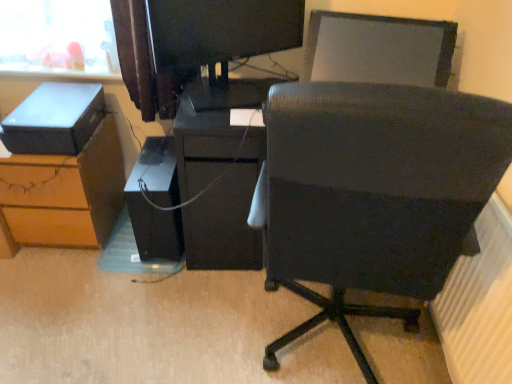
This screenshot has width=512, height=384. What are the coordinates of `free point above black matte computer tower at center (from a real-world perspective)` in the screenshot? It's located at (x=153, y=159).